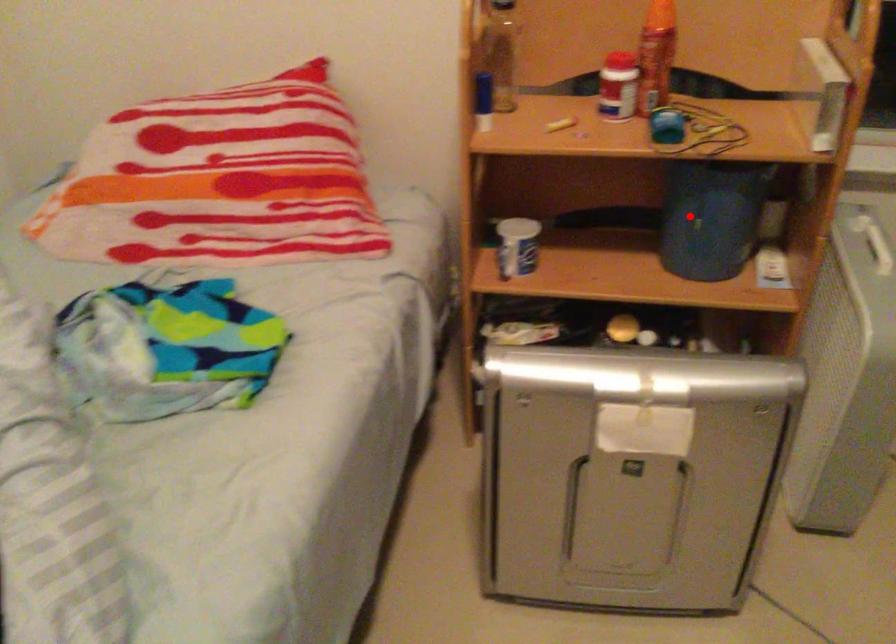
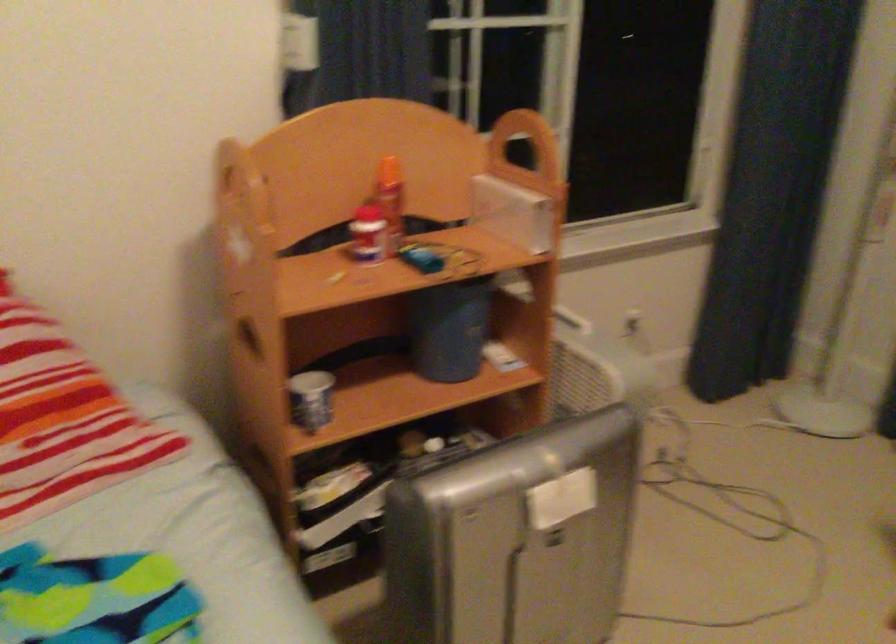
Find the pixel in the second image that matches the highlighted location in the first image.

(449, 328)